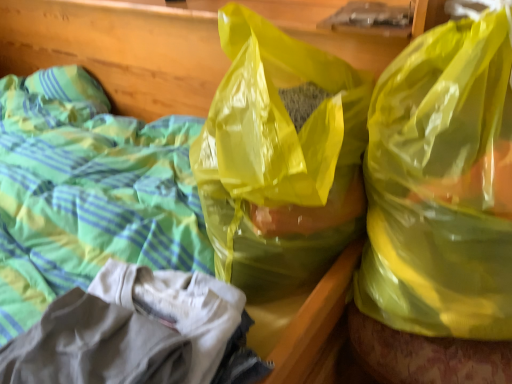
Question: In terms of size, does translucent yellow plastic bag at center, the first plastic bag from the left, appear bigger or smaller than yellow translucent plastic bag at upper right, placed as the 2th plastic bag when sorted from left to right?

Choices:
 (A) small
 (B) big

Answer: (B)

Question: From the image's perspective, is translucent yellow plastic bag at center, the first plastic bag from the left, positioned above or below yellow translucent plastic bag at upper right, which is the 1th plastic bag in right-to-left order?

Choices:
 (A) above
 (B) below

Answer: (A)

Question: Which is correct: translucent yellow plastic bag at center, arranged as the 2th plastic bag when viewed from the right, is inside yellow translucent plastic bag at upper right, which is the 1th plastic bag in right-to-left order, or outside of it?

Choices:
 (A) outside
 (B) inside

Answer: (A)

Question: From the image's perspective, relative to translucent yellow plastic bag at center, the first plastic bag from the left, is yellow translucent plastic bag at upper right, which is the 1th plastic bag in right-to-left order, above or below?

Choices:
 (A) above
 (B) below

Answer: (B)

Question: Is yellow translucent plastic bag at upper right, placed as the 2th plastic bag when sorted from left to right, in front of or behind translucent yellow plastic bag at center, arranged as the 2th plastic bag when viewed from the right, in the image?

Choices:
 (A) behind
 (B) front

Answer: (B)

Question: Is point (490, 129) closer or farther from the camera than point (344, 119)?

Choices:
 (A) farther
 (B) closer

Answer: (B)

Question: Choose the correct answer: Is yellow translucent plastic bag at upper right, placed as the 2th plastic bag when sorted from left to right, inside translucent yellow plastic bag at center, arranged as the 2th plastic bag when viewed from the right, or outside it?

Choices:
 (A) inside
 (B) outside

Answer: (B)